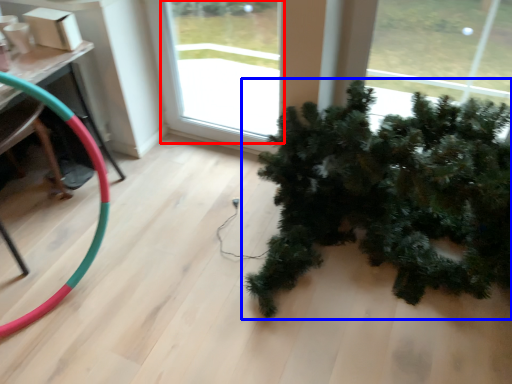
Question: Among these objects, which one is farthest to the camera, window (highlighted by a red box) or houseplant (highlighted by a blue box)?

Choices:
 (A) window
 (B) houseplant

Answer: (A)